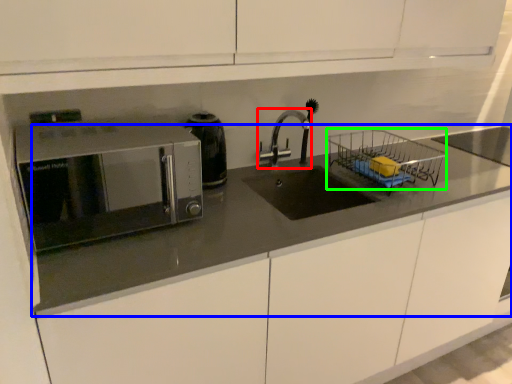
Question: Which is nearer to the tap (highlighted by a red box)? countertop (highlighted by a blue box) or basket (highlighted by a green box).

Choices:
 (A) countertop
 (B) basket

Answer: (B)